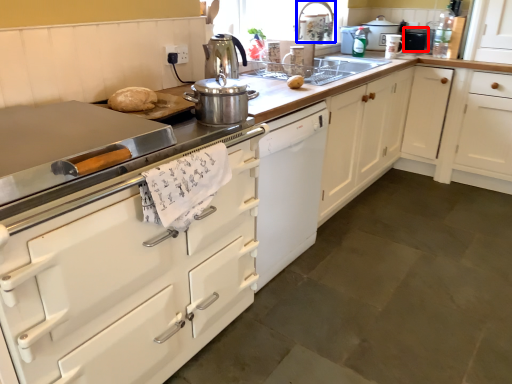
Question: Which of the following is the closest to the observer, appliance (highlighted by a red box) or faucet (highlighted by a blue box)?

Choices:
 (A) appliance
 (B) faucet

Answer: (B)